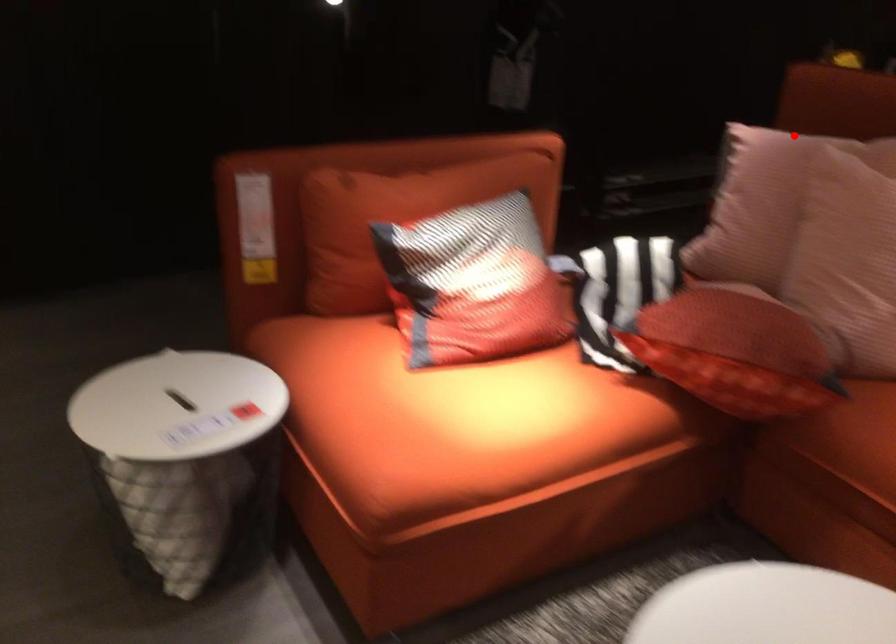
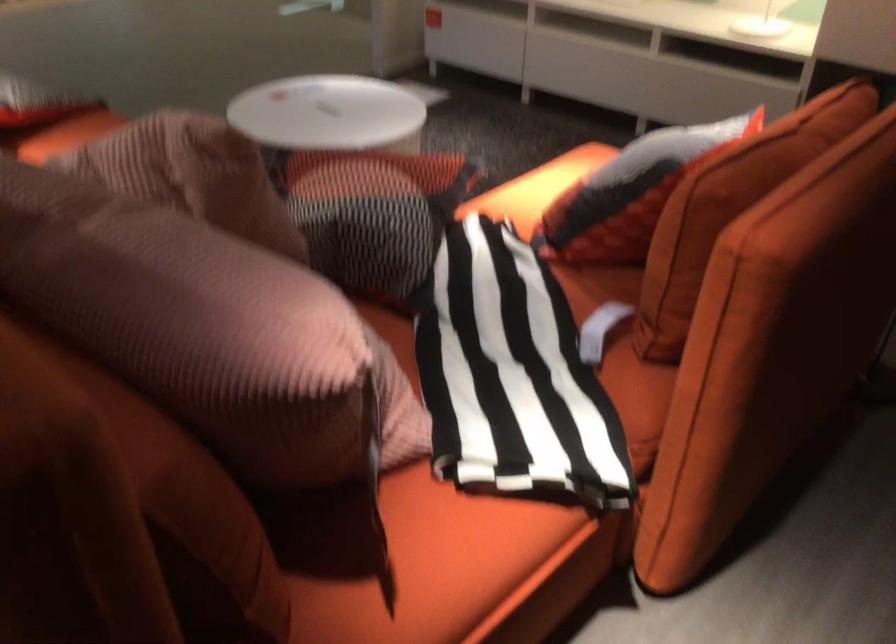
Locate, in the second image, the point that corresponds to the highlighted location in the first image.

(205, 328)